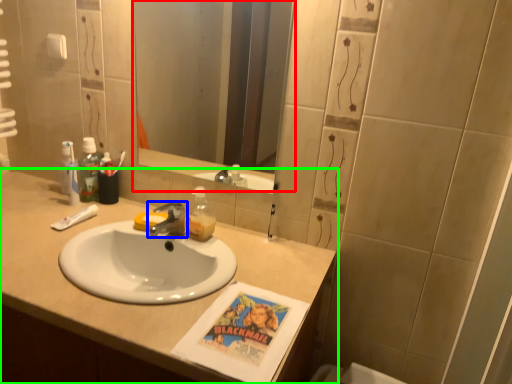
Question: Considering the real-world distances, which object is closest to mirror (highlighted by a red box)? tap (highlighted by a blue box) or bathroom cabinet (highlighted by a green box).

Choices:
 (A) tap
 (B) bathroom cabinet

Answer: (B)